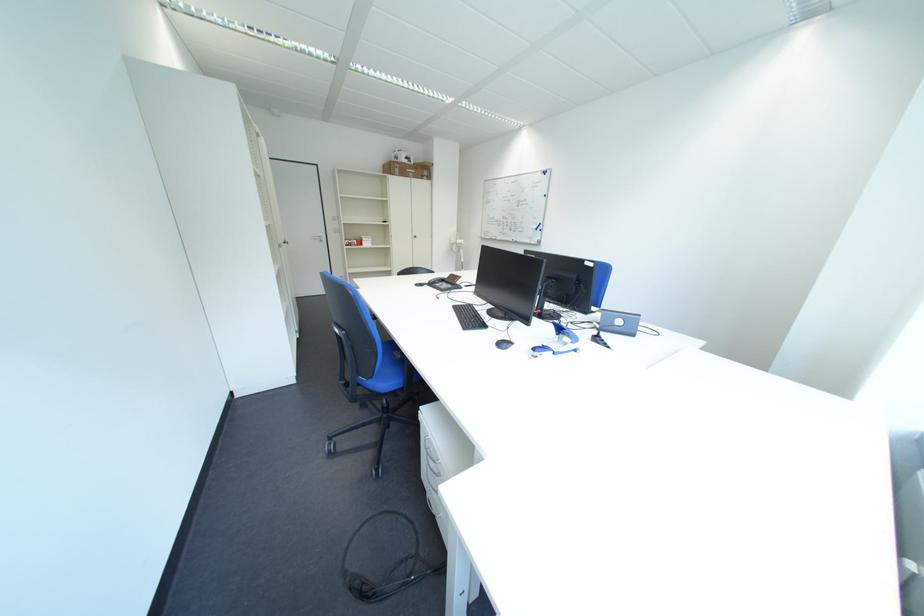
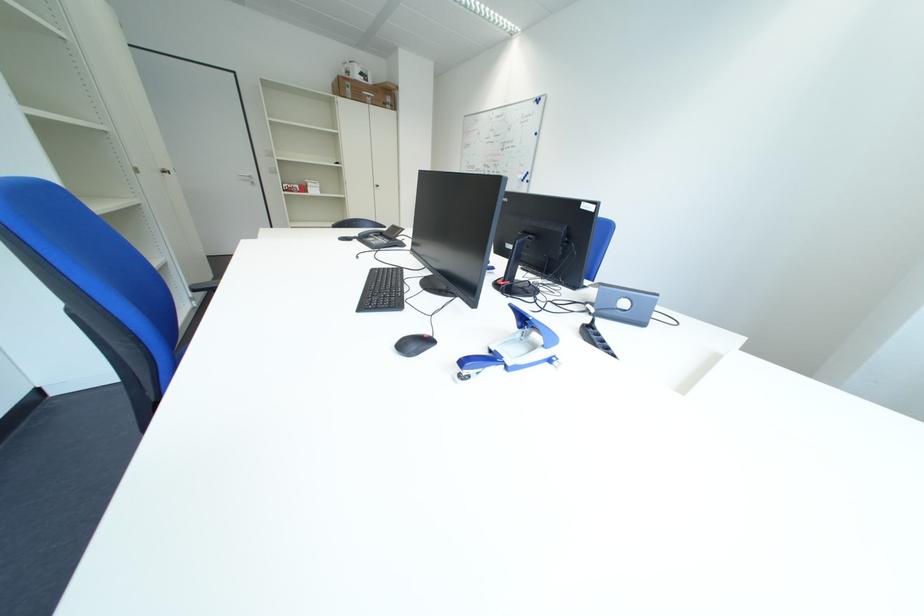
Where in the second image is the point corresponding to (546,352) from the first image?

(475, 365)